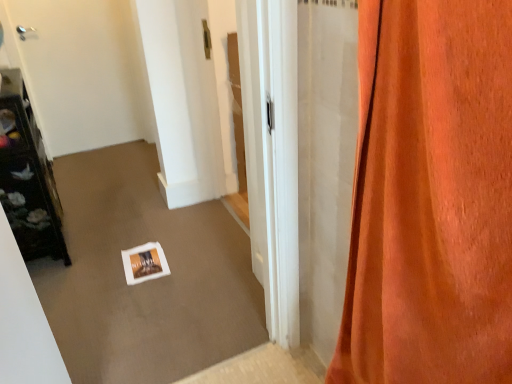
Question: Is orange velvet curtain at right looking in the opposite direction of dark brown wooden shelf at left?

Choices:
 (A) yes
 (B) no

Answer: (B)

Question: Is orange velvet curtain at right smaller than dark brown wooden shelf at left?

Choices:
 (A) no
 (B) yes

Answer: (B)

Question: Is orange velvet curtain at right bigger than dark brown wooden shelf at left?

Choices:
 (A) yes
 (B) no

Answer: (B)

Question: From the image's perspective, is orange velvet curtain at right above dark brown wooden shelf at left?

Choices:
 (A) yes
 (B) no

Answer: (B)

Question: Considering the relative sizes of orange velvet curtain at right and dark brown wooden shelf at left in the image provided, is orange velvet curtain at right wider than dark brown wooden shelf at left?

Choices:
 (A) no
 (B) yes

Answer: (A)

Question: Considering the relative positions of orange velvet curtain at right and dark brown wooden shelf at left in the image provided, is orange velvet curtain at right to the right of dark brown wooden shelf at left from the viewer's perspective?

Choices:
 (A) yes
 (B) no

Answer: (A)

Question: Considering the relative sizes of white glossy door at upper left and dark brown wooden shelf at left in the image provided, is white glossy door at upper left smaller than dark brown wooden shelf at left?

Choices:
 (A) no
 (B) yes

Answer: (B)

Question: Is dark brown wooden shelf at left completely or partially inside white glossy door at upper left?

Choices:
 (A) no
 (B) yes

Answer: (A)

Question: From the image's perspective, would you say white glossy door at upper left is positioned over dark brown wooden shelf at left?

Choices:
 (A) yes
 (B) no

Answer: (A)

Question: Can you confirm if white glossy door at upper left is positioned to the right of dark brown wooden shelf at left?

Choices:
 (A) yes
 (B) no

Answer: (B)

Question: Is white glossy door at upper left oriented away from dark brown wooden shelf at left?

Choices:
 (A) yes
 (B) no

Answer: (B)

Question: Does white glossy door at upper left appear on the left side of dark brown wooden shelf at left?

Choices:
 (A) no
 (B) yes

Answer: (B)

Question: From the image's perspective, is dark brown wooden shelf at left beneath orange velvet curtain at right?

Choices:
 (A) no
 (B) yes

Answer: (A)